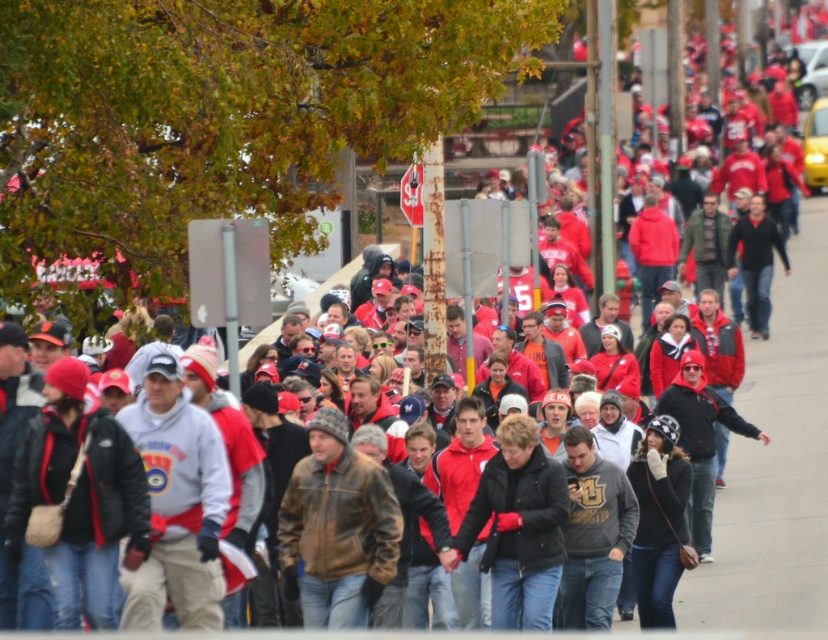
Question: Estimate the real-world distances between objects in this image. Which object is closer to the brown leather jacket at center?

Choices:
 (A) matte black jacket at center
 (B) black leather jacket at center

Answer: (B)

Question: Can you confirm if matte black jacket at center is thinner than brown leather jacket at center?

Choices:
 (A) no
 (B) yes

Answer: (A)

Question: Does matte black jacket at center have a larger size compared to brown leather jacket at center?

Choices:
 (A) yes
 (B) no

Answer: (A)

Question: Which point is farther to the camera?

Choices:
 (A) black leather jacket at center
 (B) brown leather jacket at center

Answer: (A)

Question: Is matte black jacket at center to the right of brown leather jacket at center from the viewer's perspective?

Choices:
 (A) yes
 (B) no

Answer: (B)

Question: Which point is farther from the camera taking this photo?

Choices:
 (A) (282, 566)
 (B) (15, 500)
 (C) (499, 458)

Answer: (C)